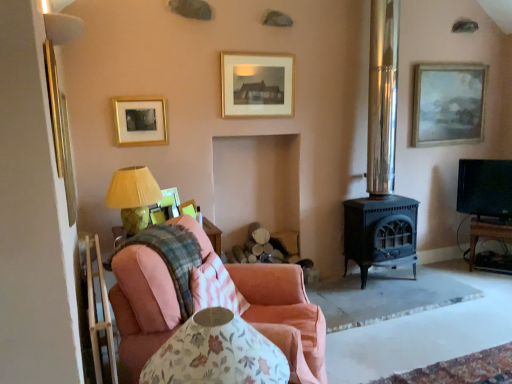
In order to click on empty space that is ontop of gold-framed print at upper center, which is the fourth picture frame in front-to-back order (from a real-world perspective) in this screenshot , I will do `click(262, 51)`.